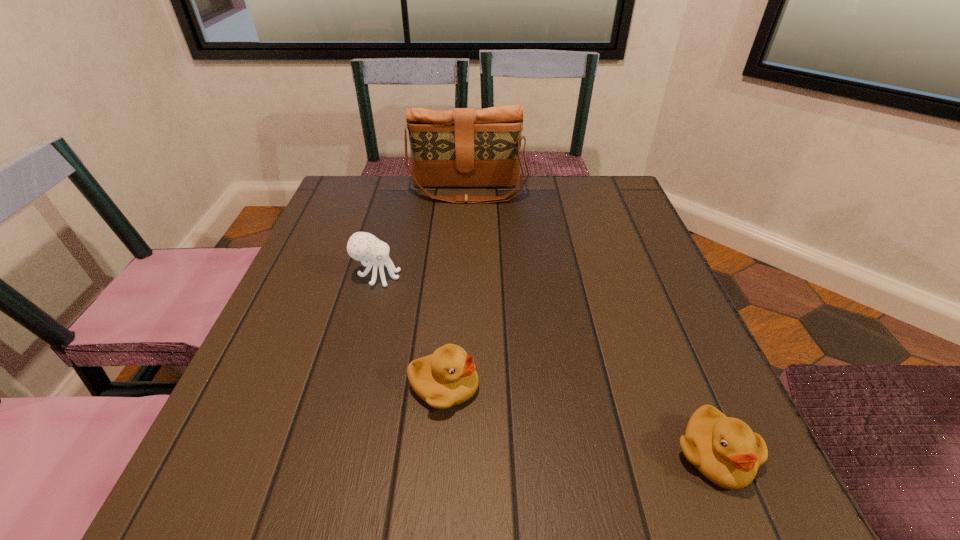
Locate an element on the screen. The height and width of the screenshot is (540, 960). free point between the third shortest object and the left duckling is located at coordinates (411, 331).

I want to click on free space between the third farthest object and the tallest object, so click(456, 289).

The width and height of the screenshot is (960, 540). What are the coordinates of `free space between the farther duckling and the octopus` in the screenshot? It's located at (411, 331).

Identify which object is the closest to the octopus. Please provide its 2D coordinates. Your answer should be formatted as a tuple, i.e. [(x, y)], where the tuple contains the x and y coordinates of a point satisfying the conditions above.

[(446, 378)]

Find the location of a particular element. object that ranks as the third closest to the nearer duckling is located at coordinates (464, 147).

The image size is (960, 540). Find the location of `free region that satisfies the following two spatial constraints: 1. on the front-facing side of the farthest object; 2. on the front-facing side of the left duckling`. free region that satisfies the following two spatial constraints: 1. on the front-facing side of the farthest object; 2. on the front-facing side of the left duckling is located at coordinates (460, 387).

Where is `blank space that satisfies the following two spatial constraints: 1. on the front-facing side of the tallest object; 2. on the front-facing side of the second tallest object`? The image size is (960, 540). blank space that satisfies the following two spatial constraints: 1. on the front-facing side of the tallest object; 2. on the front-facing side of the second tallest object is located at coordinates (465, 276).

Image resolution: width=960 pixels, height=540 pixels. Find the location of `free spot that satisfies the following two spatial constraints: 1. on the front-facing side of the tallest object; 2. on the front-facing side of the third shortest object`. free spot that satisfies the following two spatial constraints: 1. on the front-facing side of the tallest object; 2. on the front-facing side of the third shortest object is located at coordinates (465, 276).

Identify the location of free spot that satisfies the following two spatial constraints: 1. on the front-facing side of the tallest object; 2. on the front-facing side of the farther duckling. The image size is (960, 540). (460, 387).

Identify the location of vacant space that satisfies the following two spatial constraints: 1. on the front-facing side of the tallest object; 2. on the front-facing side of the octopus. The height and width of the screenshot is (540, 960). (465, 276).